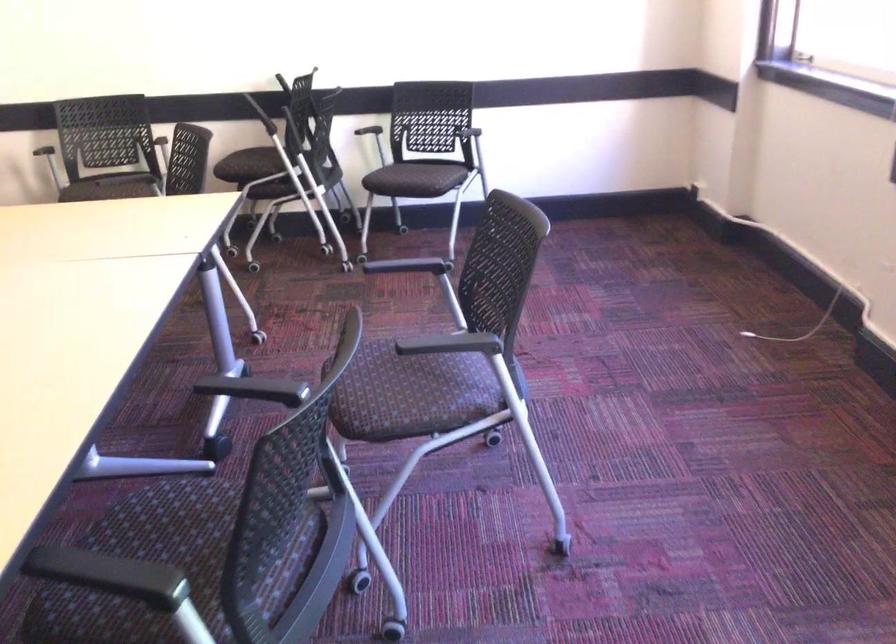
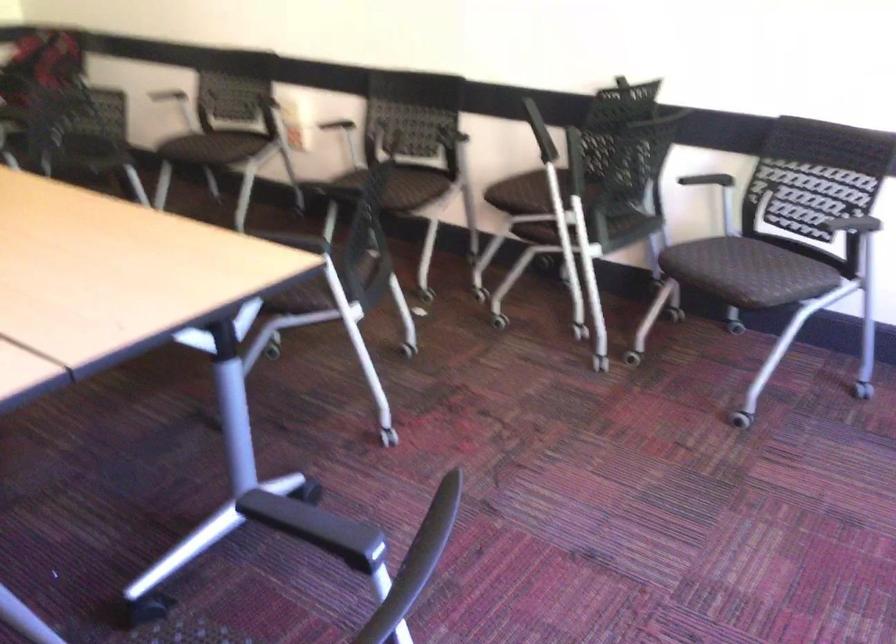
Where in the second image is the point corresponding to (131,184) from the first image?

(402, 187)